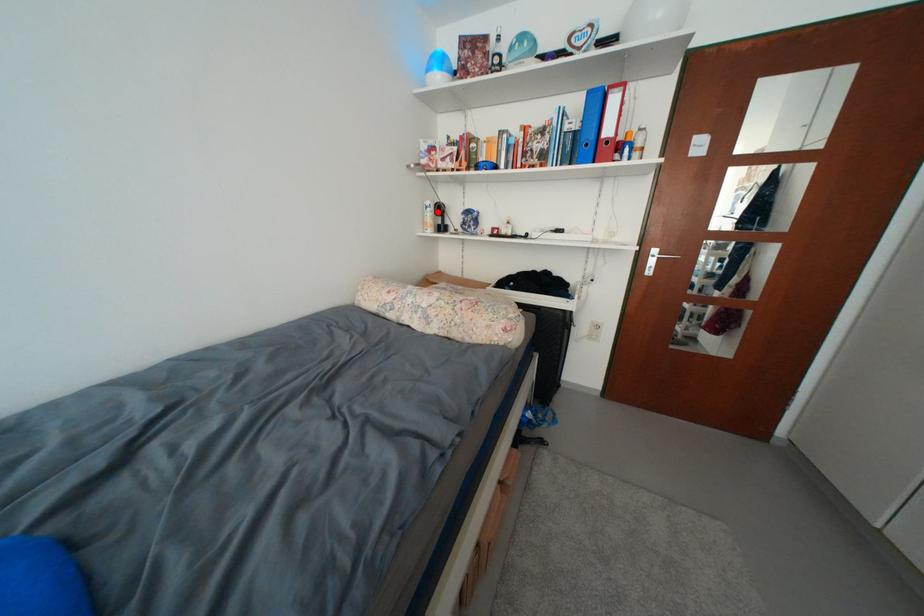
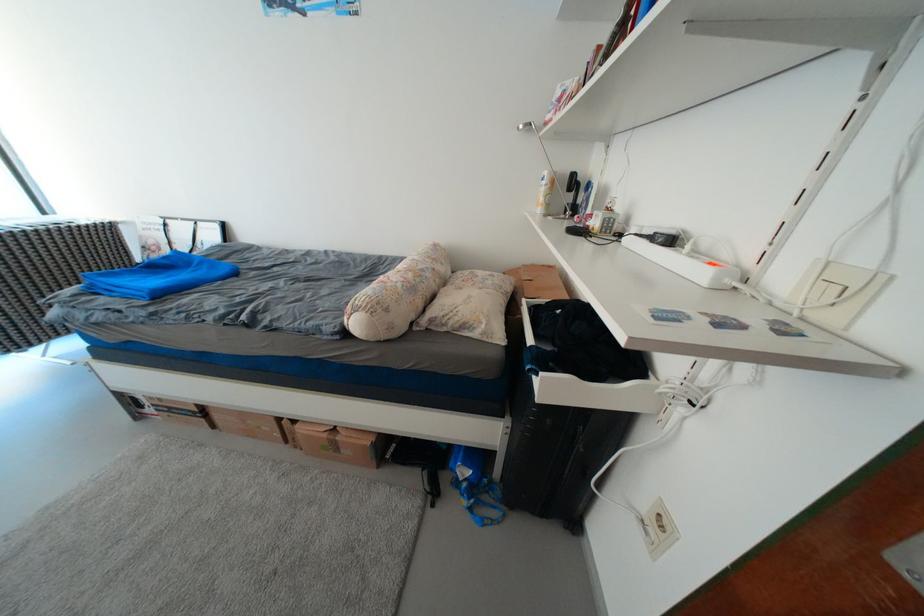
In the second image, find the point that corresponds to the highlighted location in the first image.

(553, 185)